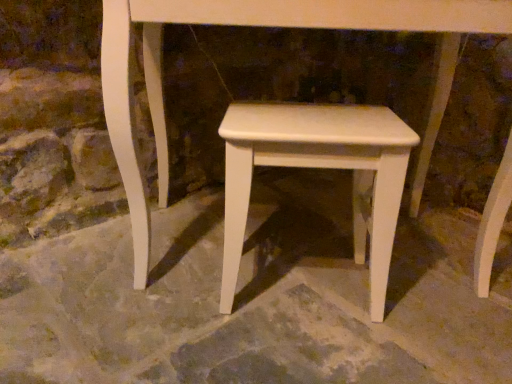
You are a GUI agent. You are given a task and a screenshot of the screen. Output one action in this format:
    pyautogui.click(x=<x>, y=<y>)
    Task: Click on the vacant space situated above white matte stool at center (from a real-world perspective)
    
    Given the screenshot: What is the action you would take?
    pyautogui.click(x=315, y=120)